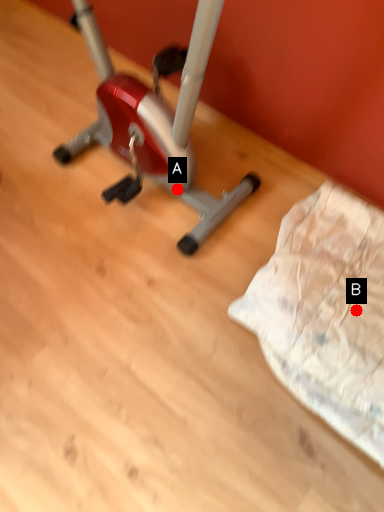
Question: Two points are circled on the image, labeled by A and B beside each circle. Among these points, which one is farthest from the camera?

Choices:
 (A) A is further
 (B) B is further

Answer: (A)